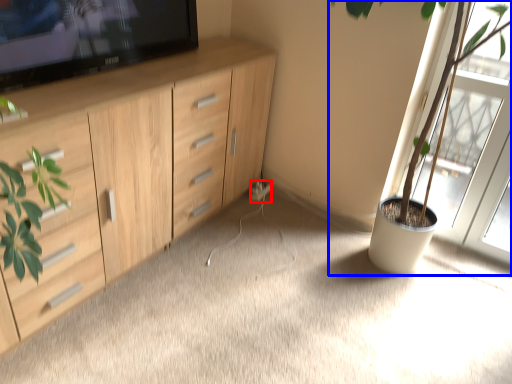
Question: Which point is closer to the camera, electric outlet (highlighted by a red box) or houseplant (highlighted by a blue box)?

Choices:
 (A) electric outlet
 (B) houseplant

Answer: (B)